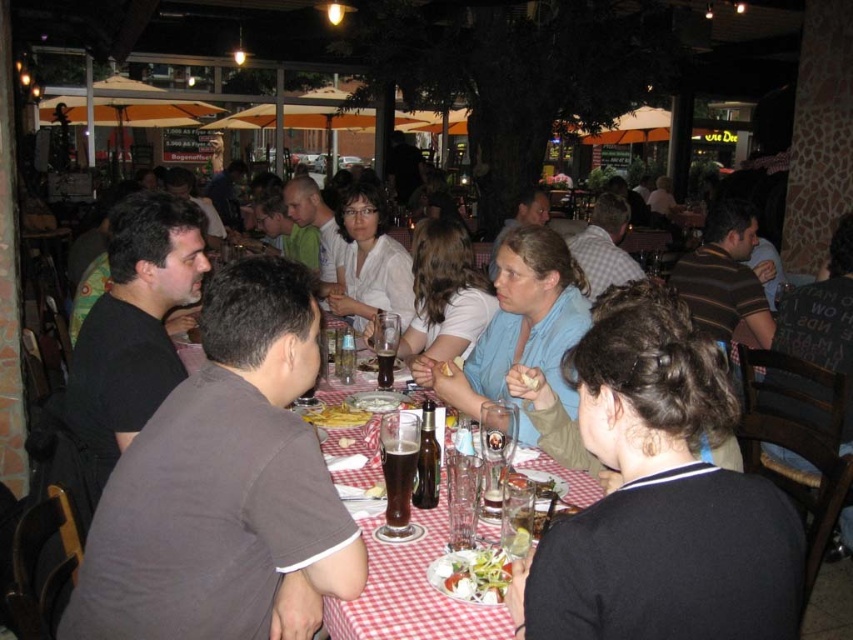
Question: From the image, what is the correct spatial relationship of white glossy salad at center in relation to brown glass beer at center?

Choices:
 (A) above
 (B) below

Answer: (B)

Question: Which point appears farthest from the camera in this image?

Choices:
 (A) (387, 364)
 (B) (456, 324)

Answer: (B)

Question: Which of the following is the farthest from the observer?

Choices:
 (A) (421, 484)
 (B) (405, 577)

Answer: (A)

Question: In this image, where is dark brown shirt at left located relative to checkered fabric table at center?

Choices:
 (A) below
 (B) above

Answer: (B)

Question: Does blue fabric shirt at center lie in front of smooth white bread at center?

Choices:
 (A) no
 (B) yes

Answer: (A)

Question: Which point is closer to the camera taking this photo?

Choices:
 (A) (500, 392)
 (B) (521, 378)

Answer: (B)